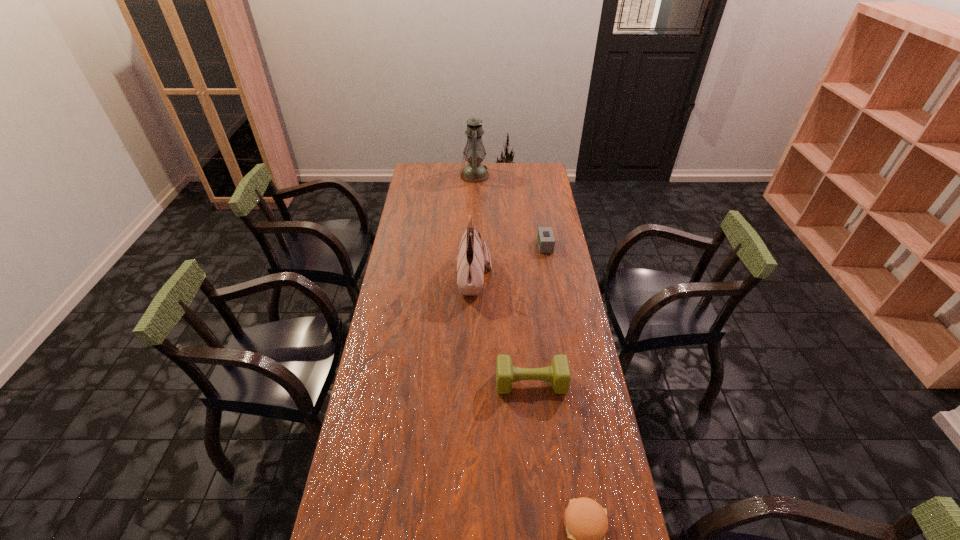
The image size is (960, 540). Find the location of `free region located 0.350m on the front-facing side of the second shortest object`. free region located 0.350m on the front-facing side of the second shortest object is located at coordinates (460, 246).

This screenshot has width=960, height=540. I want to click on object located at the far edge, so click(474, 172).

Locate an element on the screen. dumbbell that is at the right edge is located at coordinates (558, 373).

The width and height of the screenshot is (960, 540). Identify the location of alarm clock situated at the right edge. (546, 241).

This screenshot has width=960, height=540. Identify the location of free space at the far edge. (456, 176).

Where is `vacant region at the left edge`? This screenshot has height=540, width=960. vacant region at the left edge is located at coordinates (372, 388).

Where is `free region at the right edge of the desktop`? free region at the right edge of the desktop is located at coordinates (544, 305).

Identify the location of vacant space at the far right corner of the desktop. (528, 172).

In order to click on free space between the handbag and the third tallest object in this screenshot , I will do `click(503, 330)`.

The image size is (960, 540). Find the location of `vacant region between the oil lamp and the second shortest object`. vacant region between the oil lamp and the second shortest object is located at coordinates (510, 211).